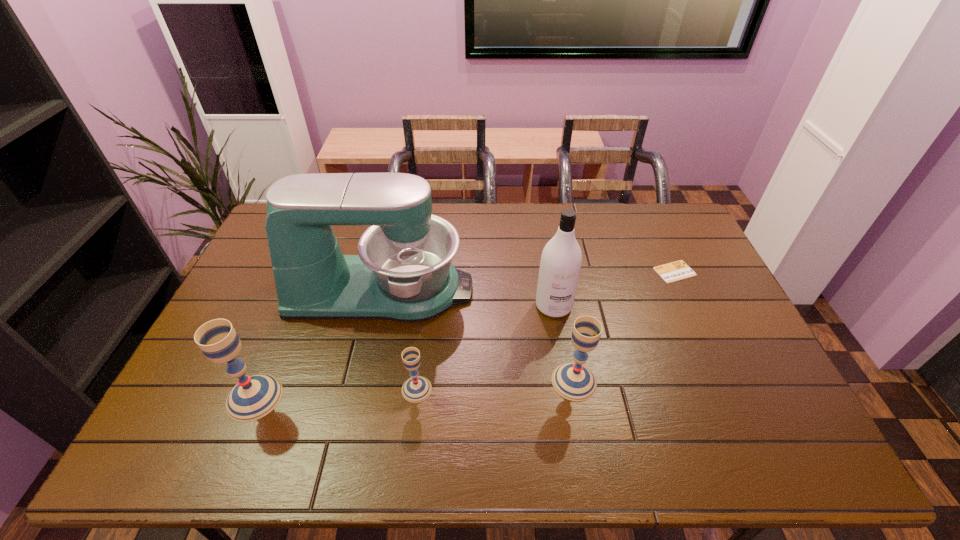
Image resolution: width=960 pixels, height=540 pixels. Identify the location of vacant space located 0.150m on the right of the shortest chalice. (490, 389).

At what (x,y) coordinates should I click in order to perform the action: click on vacant area situated on the left of the rightmost chalice. Please return your answer as a coordinate pair (x, y). The height and width of the screenshot is (540, 960). Looking at the image, I should click on (533, 381).

Identify the location of free space located 0.300m on the back of the shortest object. (646, 210).

You are a GUI agent. You are given a task and a screenshot of the screen. Output one action in this format:
    pyautogui.click(x=<x>, y=<y>)
    Task: Click on the vacant region located 0.330m on the front-facing side of the mixer
    Image resolution: width=960 pixels, height=540 pixels.
    Given the screenshot: What is the action you would take?
    pyautogui.click(x=576, y=290)

At what (x,y) coordinates should I click in order to perform the action: click on vacant space located 0.200m on the front-facing side of the shampoo. Please return your answer as a coordinate pair (x, y). The image size is (960, 540). Looking at the image, I should click on (565, 377).

Identify the location of object at the left edge. (255, 396).

At what (x,y) coordinates should I click in order to perform the action: click on object at the right edge. Please return your answer as a coordinate pair (x, y). The width and height of the screenshot is (960, 540). Looking at the image, I should click on (678, 270).

Identify the location of object that is at the near left corner. The height and width of the screenshot is (540, 960). (255, 396).

Where is `free spot at the far edge of the desktop`? This screenshot has width=960, height=540. free spot at the far edge of the desktop is located at coordinates (543, 213).

Where is `free region at the near edge`? free region at the near edge is located at coordinates (696, 408).